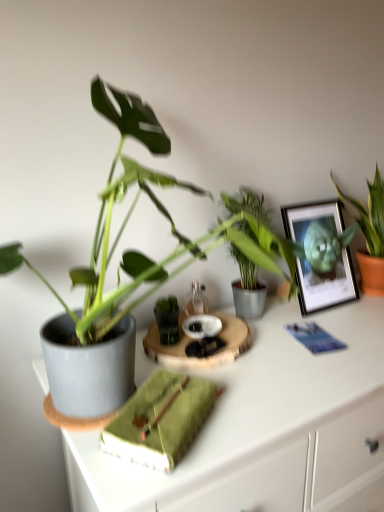
Where is `vacant space that's between green leafy plant at upper right, the 2th houseplant in the front-to-back sequence, and metallic silver picture frame at upper right`? Image resolution: width=384 pixels, height=512 pixels. vacant space that's between green leafy plant at upper right, the 2th houseplant in the front-to-back sequence, and metallic silver picture frame at upper right is located at coordinates (350, 309).